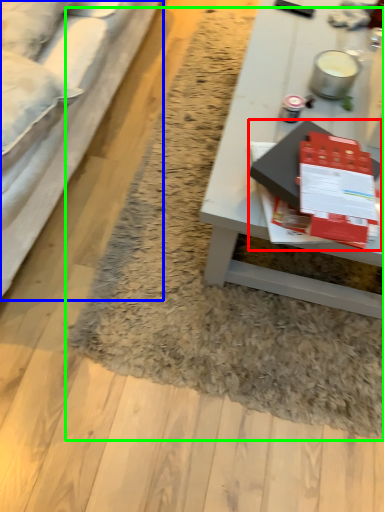
Question: Based on their relative distances, which object is farther from magazine (highlighted by a red box)? Choose from studio couch (highlighted by a blue box) and mat (highlighted by a green box).

Choices:
 (A) studio couch
 (B) mat

Answer: (A)